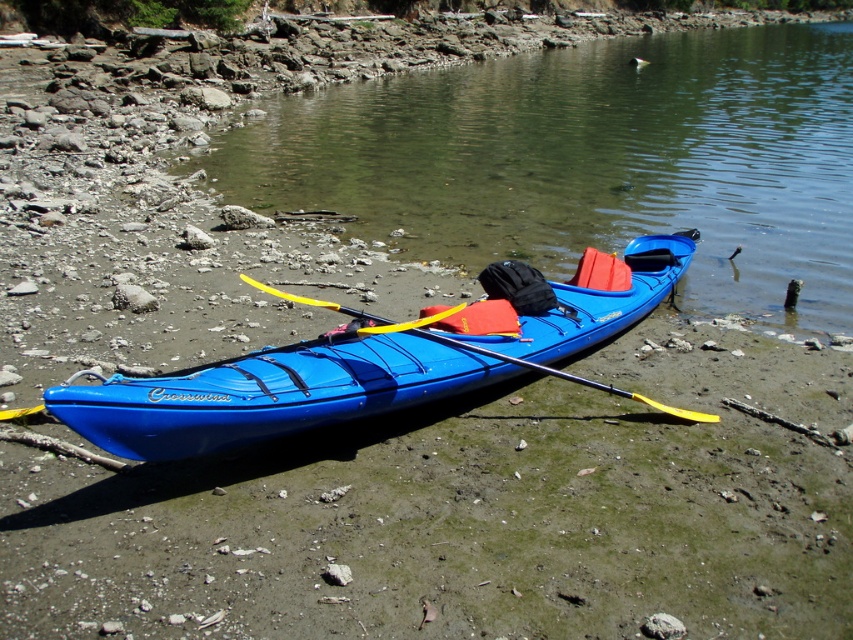
In the scene shown: You are planning to launch a small paper boat into the water. Based on the scene, which object is higher in elevation between the clear water at lower center and the yellow plastic paddle at center?

The clear water at lower center has a greater height compared to the yellow plastic paddle at center, so the clear water at lower center is higher in elevation.

You are standing at point [352,371] in the image. What object is located exactly at your current position?

The blue plastic kayak at center is located exactly at point [352,371].